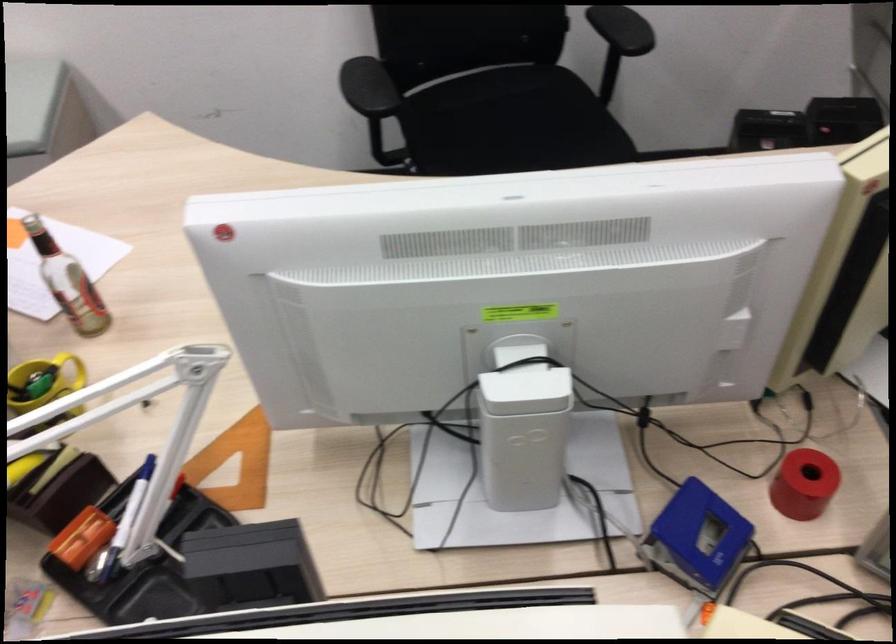
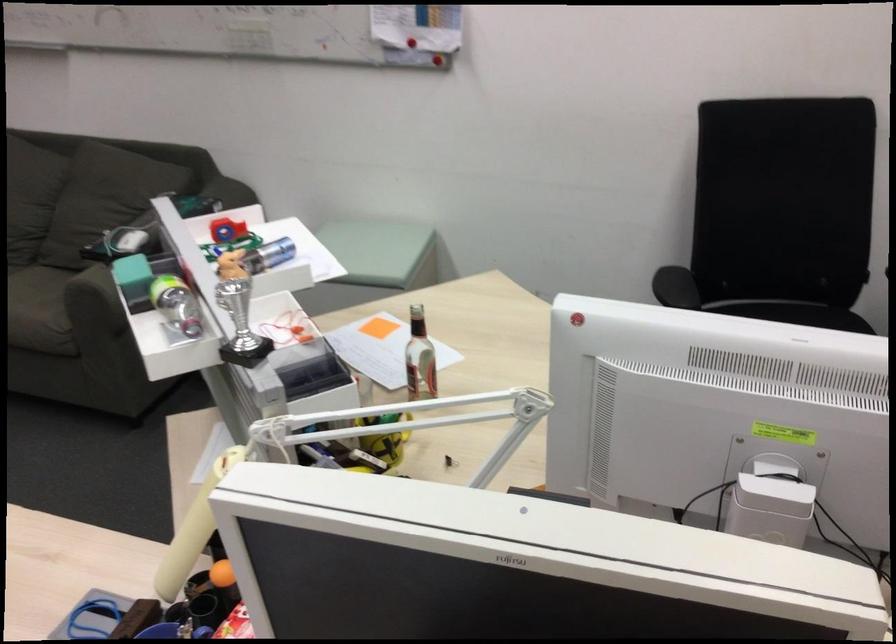
The point at (128, 343) is marked in the first image. Where is the corresponding point in the second image?

(437, 410)